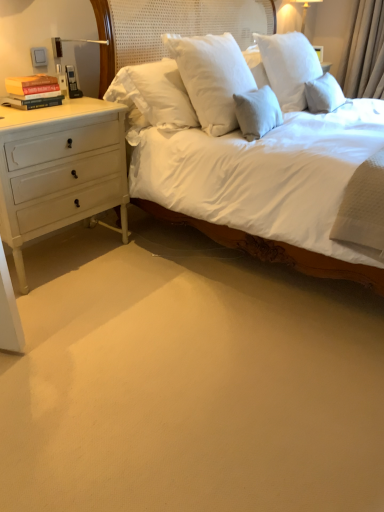
Identify the location of vacant space in front of hardcover books at left. (28, 112).